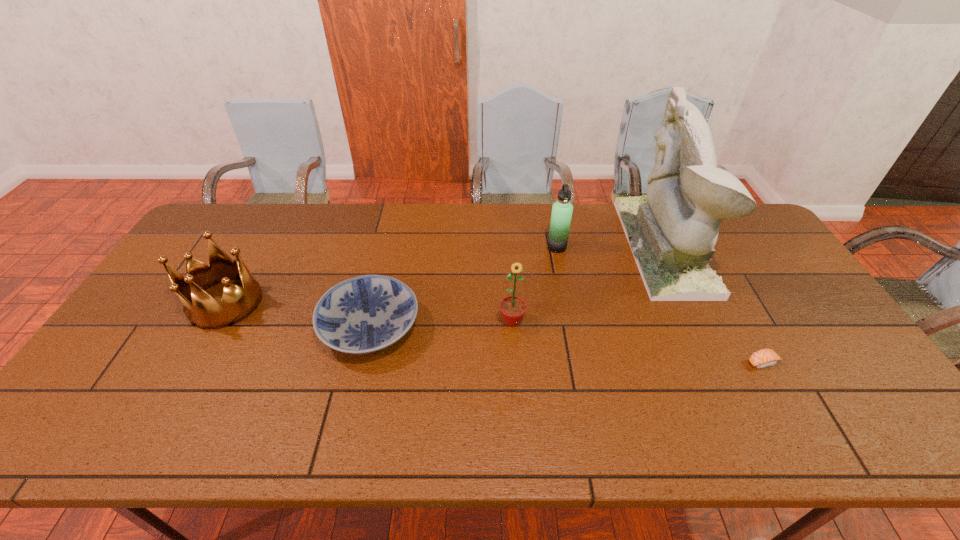
This screenshot has width=960, height=540. Identify the location of vacant area in the image that satisfies the following two spatial constraints: 1. on the base of the tallest object; 2. on the face of the third object from left to right. (698, 321).